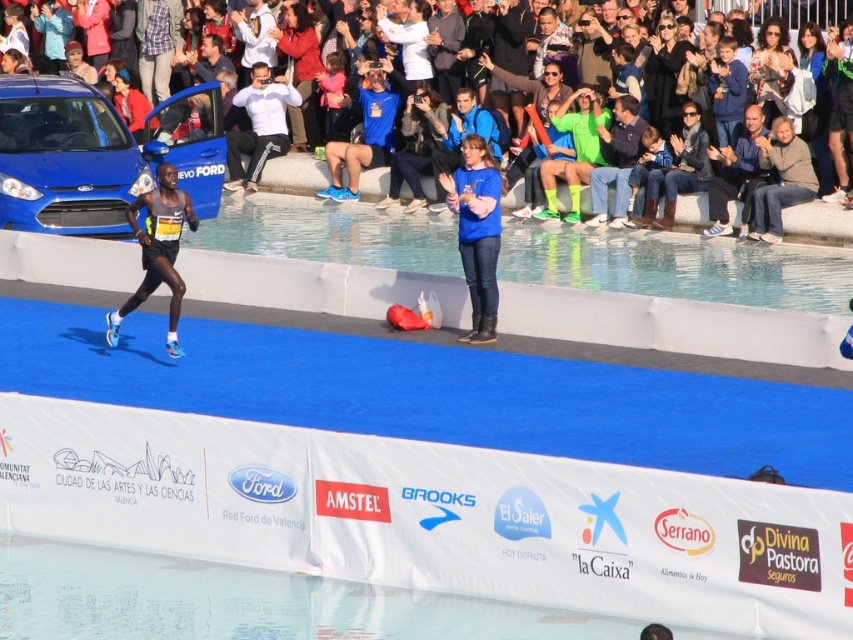
You are a photographer at the marathon event and want to capture a photo of the runner crossing the finish line. However, there is a light brown leather jacket at upper right in the frame. Based on its coordinates, will the jacket block the view of the finish line?

The light brown leather jacket at upper right is positioned at coordinates point [781,179], which is likely outside the central area where the finish line and runner are located. Therefore, it should not block the view of the finish line.

You are a photographer at the marathon event. You need to capture a photo that includes both the light brown leather jacket at upper right and the blue jeans at center. Which object should you zoom in on to include both in the frame without cropping?

You should zoom in on the blue jeans at center because the light brown leather jacket at upper right occupies less space than the blue jeans at center, so focusing on the larger object will ensure both fit in the frame.